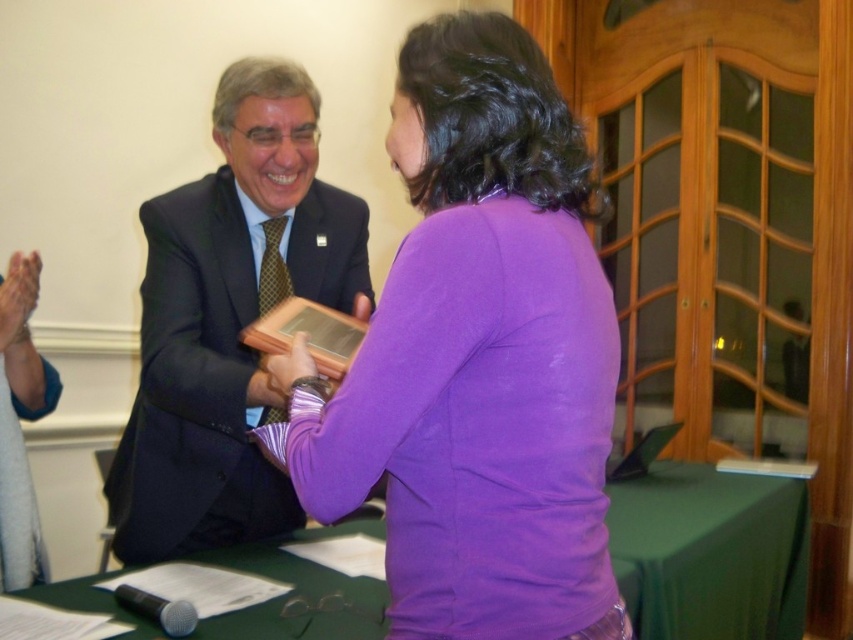
Is matte black suit at center behind green fabric table at center?

No, matte black suit at center is closer to the viewer.

Does matte black suit at center appear over green fabric table at center?

Indeed, matte black suit at center is positioned over green fabric table at center.

Who is more forward, [221,497] or [799,518]?

Point [221,497] is more forward.

The image size is (853, 640). Identify the location of matte black suit at center. (228, 320).

Which is below, purple matte shirt at center or matte black suit at center?

Positioned lower is matte black suit at center.

Identify the location of purple matte shirt at center. Image resolution: width=853 pixels, height=640 pixels. (476, 358).

Is point (340, 492) closer to viewer compared to point (222, 227)?

Yes.

Locate an element on the screen. The image size is (853, 640). purple matte shirt at center is located at coordinates (476, 358).

Can you confirm if purple matte shirt at center is bigger than green fabric table at center?

No, purple matte shirt at center is not bigger than green fabric table at center.

Can you confirm if purple matte shirt at center is shorter than green fabric table at center?

In fact, purple matte shirt at center may be taller than green fabric table at center.

This screenshot has width=853, height=640. In order to click on purple matte shirt at center in this screenshot , I will do `click(476, 358)`.